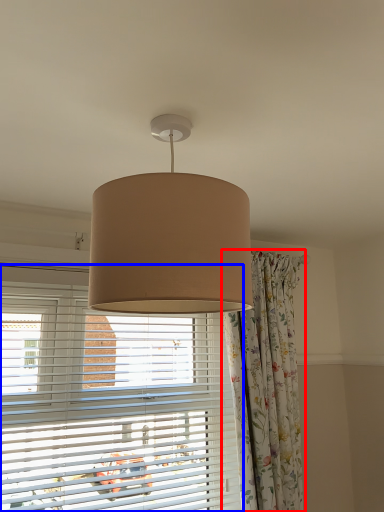
Question: Which point is further to the camera, curtain (highlighted by a red box) or window blind (highlighted by a blue box)?

Choices:
 (A) curtain
 (B) window blind

Answer: (A)